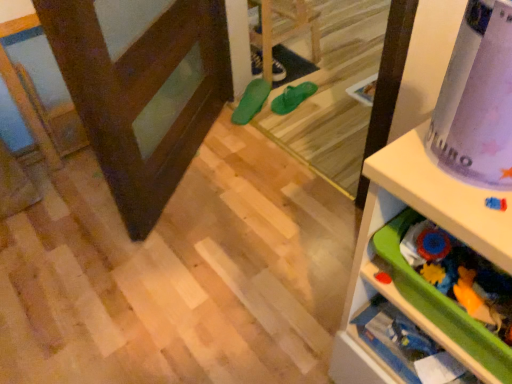
In order to click on vacant space to the right of dark brown wood screen door at left in this screenshot , I will do `click(269, 190)`.